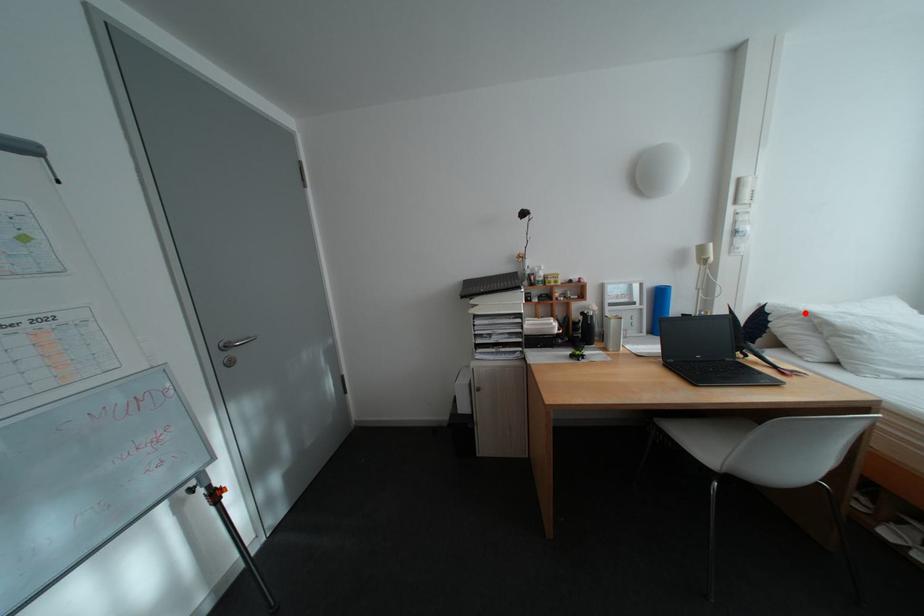
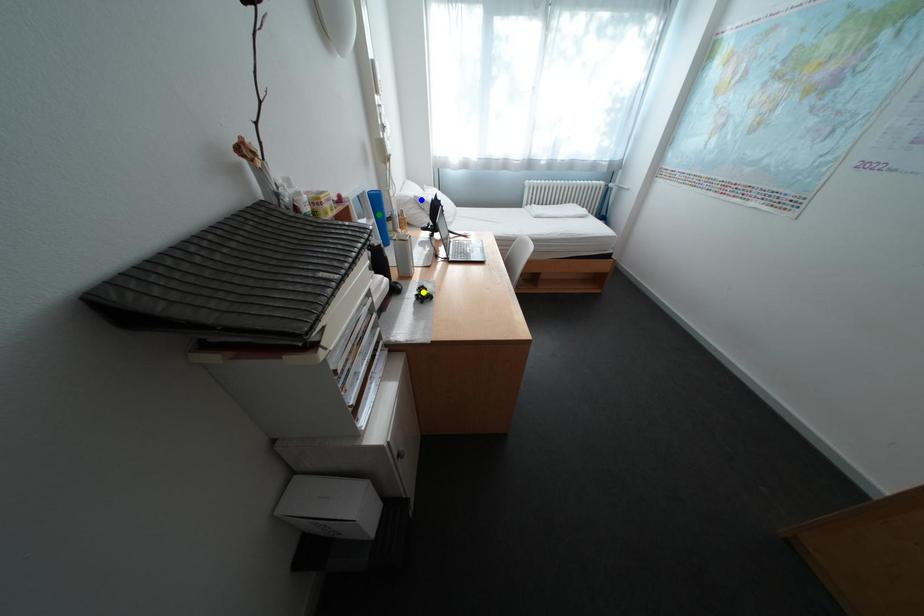
Question: I am providing you with two images of the same scene from different viewpoints. A red point is marked on the first image. You are given multiple points on the second image. Which mark in image 2 goes with the point in image 1?

Choices:
 (A) green point
 (B) yellow point
 (C) blue point

Answer: (C)